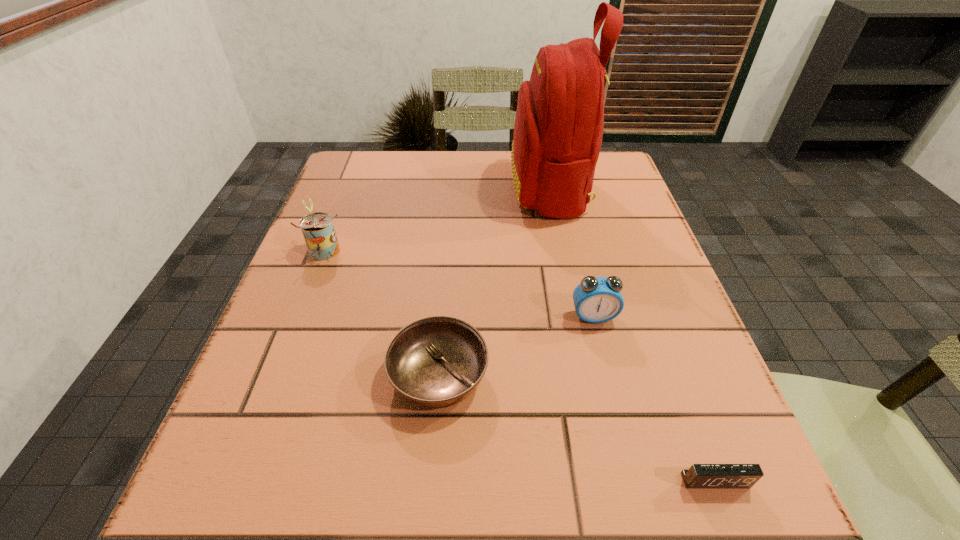
Identify the location of vacant area situated 0.070m on the front-facing side of the tallest object. This screenshot has width=960, height=540. (483, 187).

Locate an element on the screen. vacant space located on the front-facing side of the tallest object is located at coordinates (464, 187).

In order to click on free space located 0.290m on the front-facing side of the tallest object in this screenshot , I will do `click(397, 187)`.

The height and width of the screenshot is (540, 960). In order to click on vacant space situated on the front of the leftmost object in this screenshot , I will do `click(263, 400)`.

Where is `vacant space located 0.060m on the face of the taller alarm clock`? This screenshot has width=960, height=540. vacant space located 0.060m on the face of the taller alarm clock is located at coordinates (602, 351).

Identify the location of vacant space located 0.230m on the back of the soup bowl. (448, 252).

Where is `free region located 0.050m on the front-facing side of the nearest object`? The image size is (960, 540). free region located 0.050m on the front-facing side of the nearest object is located at coordinates (733, 529).

Locate an element on the screen. This screenshot has width=960, height=540. object located at the far edge is located at coordinates (558, 130).

Identify the location of object at the near edge. The width and height of the screenshot is (960, 540). click(x=699, y=476).

This screenshot has width=960, height=540. Find the location of `object at the left edge`. object at the left edge is located at coordinates (318, 230).